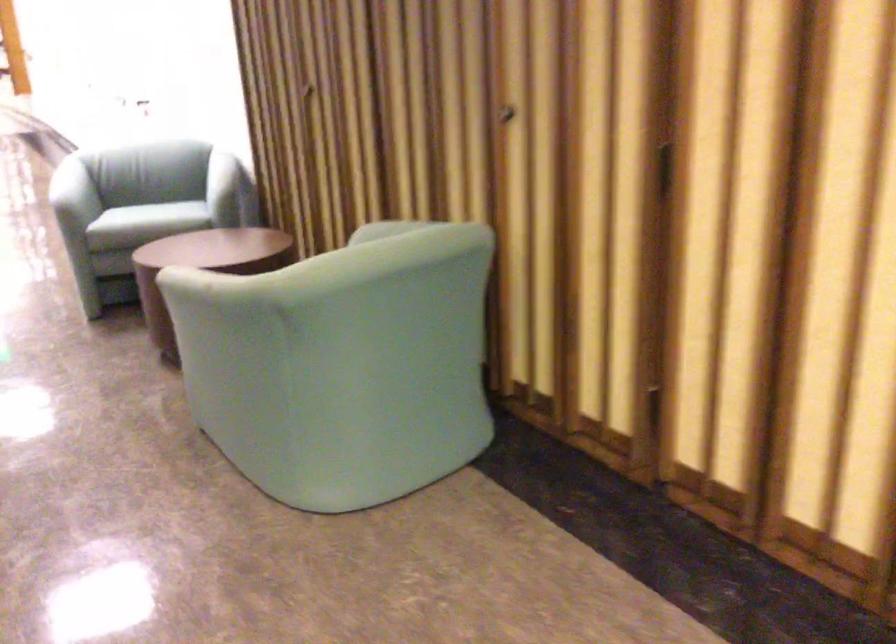
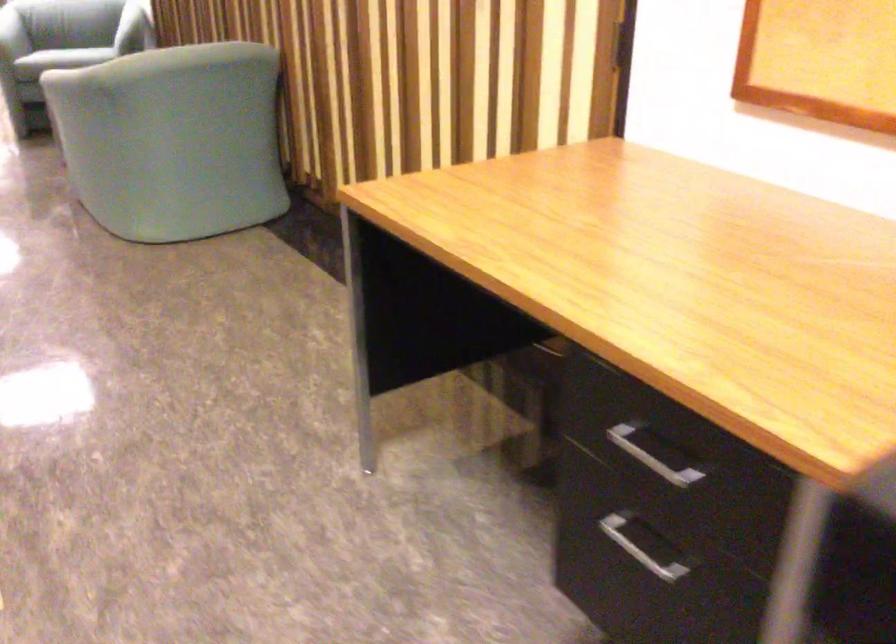
Find the pixel in the second image that matches the point at 116,212 in the first image.

(12, 35)